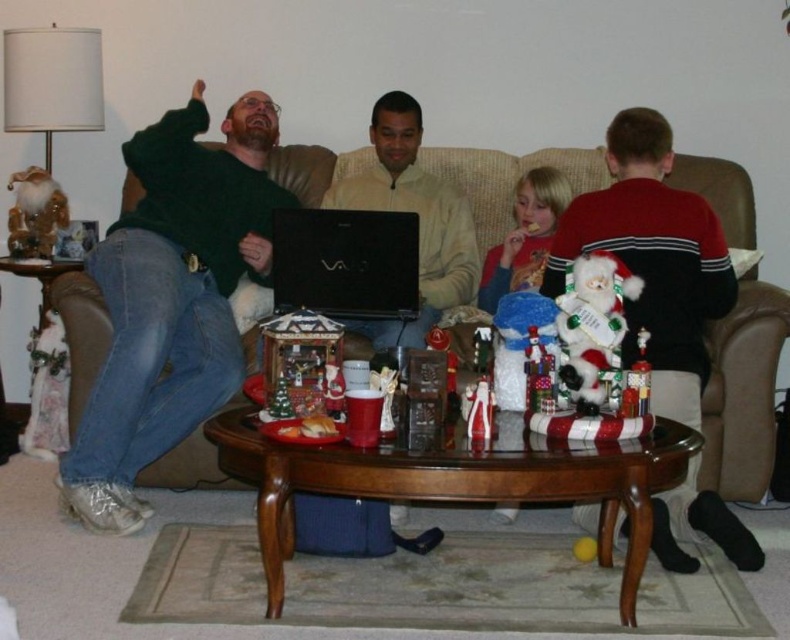
You are a guest at this holiday gathering and want to sit on the sofa between the light beige sweater at center and the blonde hair boy at center. Which side of the sofa should you sit on to be between them?

To sit between the light beige sweater at center and the blonde hair boy at center, you should sit on the side where the light beige sweater at center is located since its width surpasses the blonde hair boy at center, indicating it is positioned further out or closer to the edge.

You are a guest at this holiday gathering and want to sit next to the light beige sweater at center. Which side of the brown leather couch at center should you choose to be closest to the sweater?

To sit next to the light beige sweater at center, you should choose the left side of the brown leather couch at center because the couch is positioned to the right of the sweater.